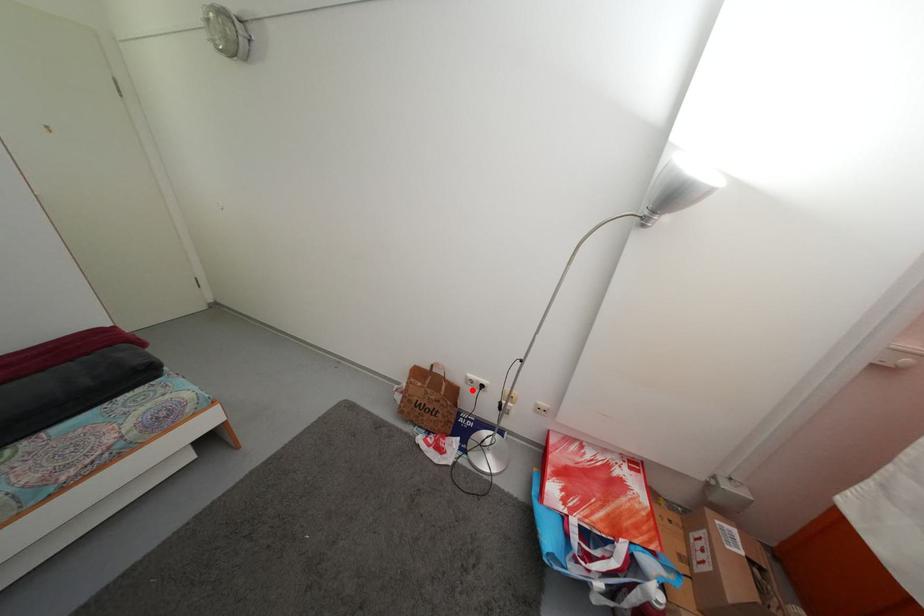
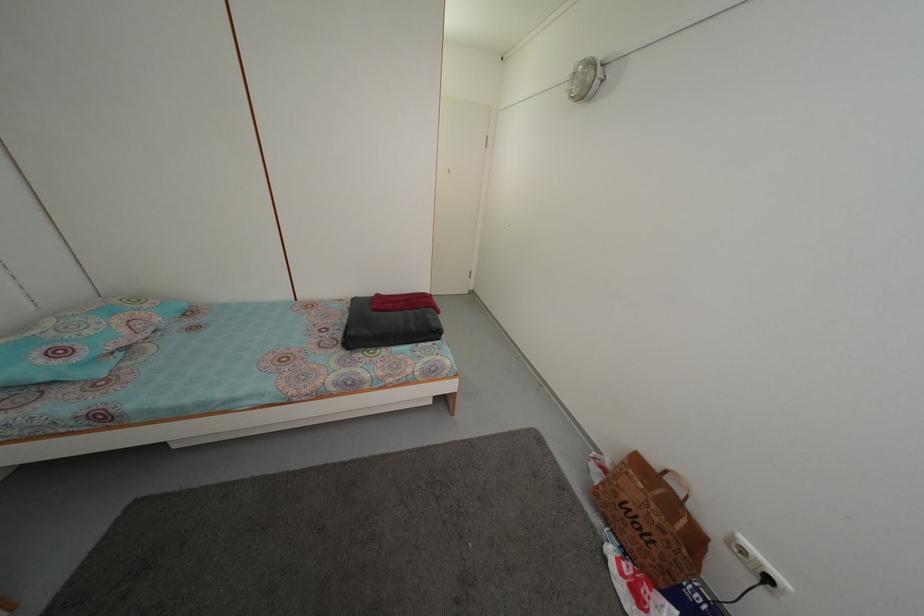
Question: I am providing you with two images of the same scene from different viewpoints. A red point is marked on the first image. At the location where the point appears in image 1, is it still visible in image 2?

Choices:
 (A) Yes
 (B) No

Answer: (A)